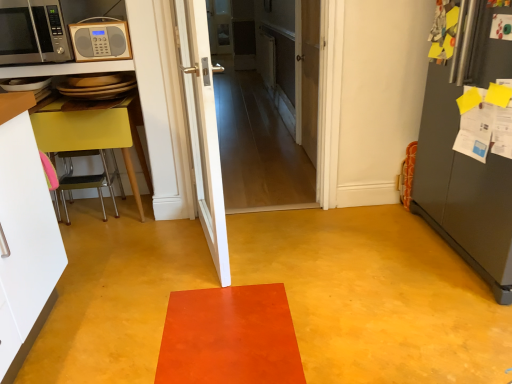
At what (x,y) coordinates should I click in order to perform the action: click on vacant region to the left of white glossy door at center, which appears as the first door when viewed from the front. Please return your answer as a coordinate pair (x, y). The image size is (512, 384). Looking at the image, I should click on (125, 263).